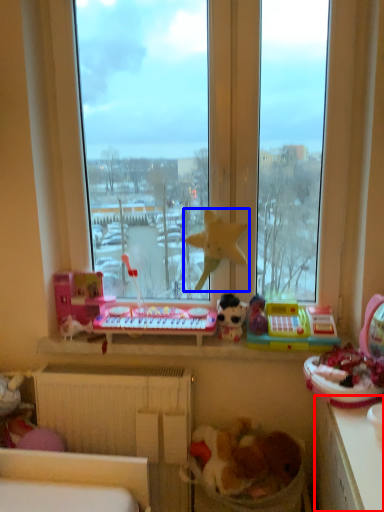
Question: Which object is closer to the camera taking this photo, counter top (highlighted by a red box) or toy (highlighted by a blue box)?

Choices:
 (A) counter top
 (B) toy

Answer: (A)